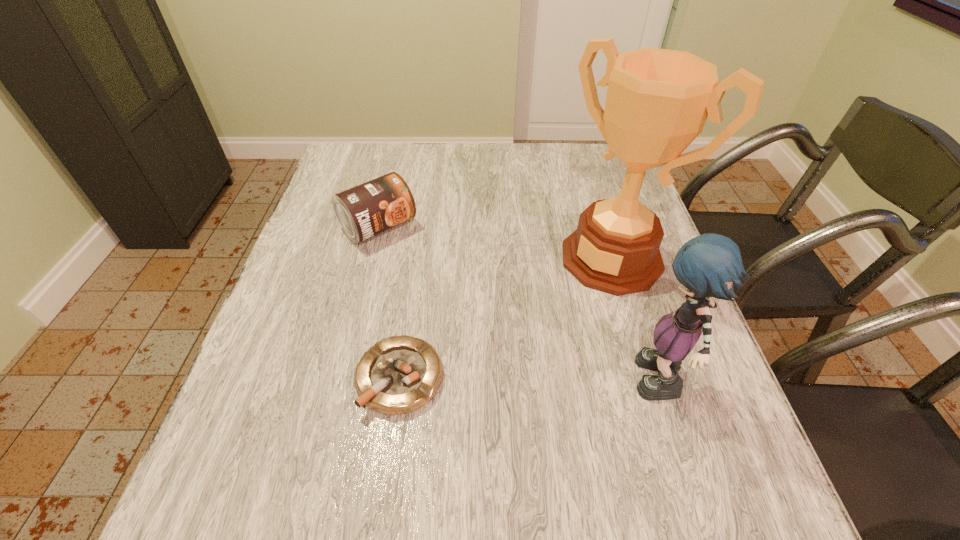
You are a GUI agent. You are given a task and a screenshot of the screen. Output one action in this format:
    pyautogui.click(x=<x>, y=<y>)
    Task: Click on the vacant space on the desktop that is between the shortest object and the third shortest object and is positioned on the front label of the can
    Image resolution: width=960 pixels, height=540 pixels.
    Given the screenshot: What is the action you would take?
    pyautogui.click(x=534, y=382)

Locate an element on the screen. This screenshot has height=540, width=960. free space on the desktop that is between the shortest object and the rag doll and is positioned on the front-facing side of the award is located at coordinates (492, 381).